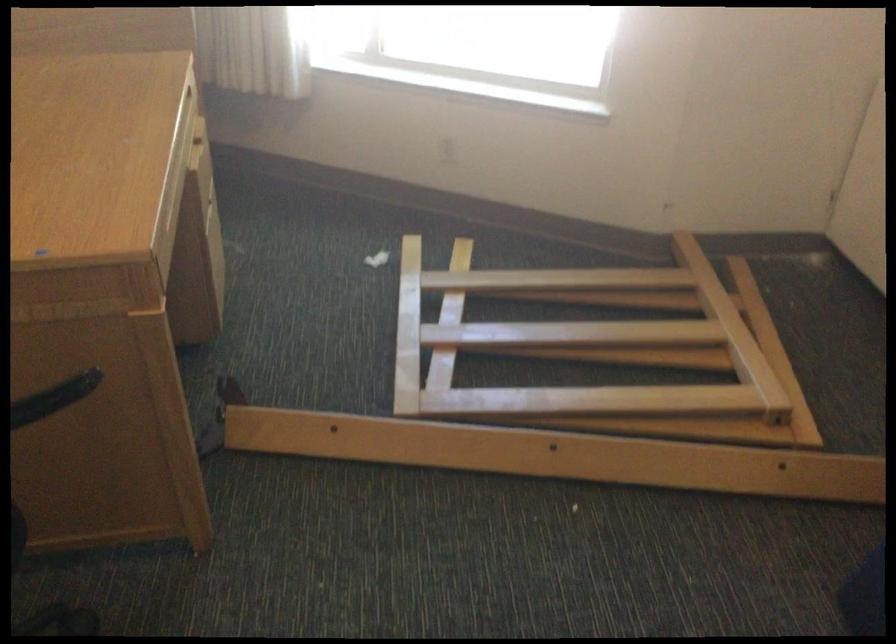
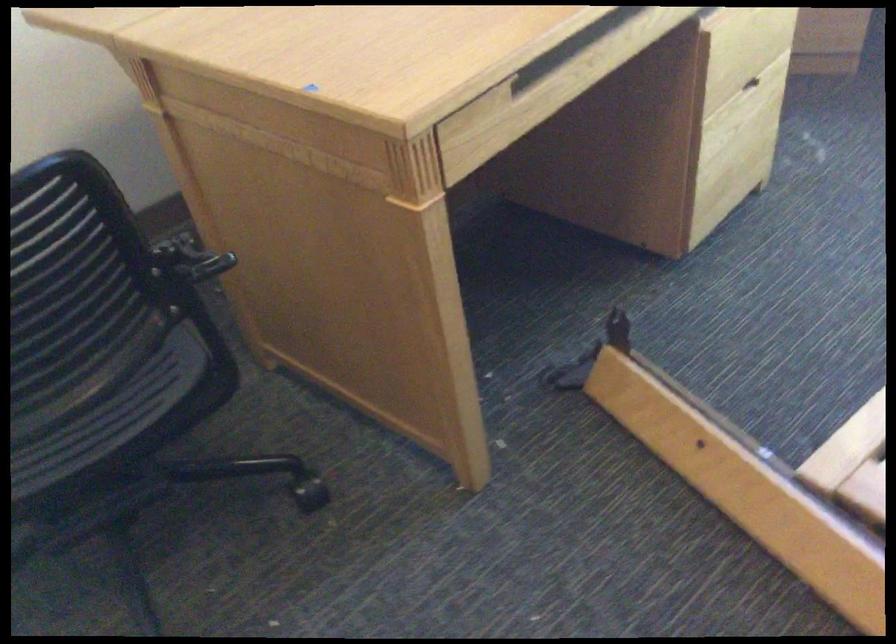
First-person continuous shooting, in which direction is the camera rotating?

The camera's rotation is toward left-down.